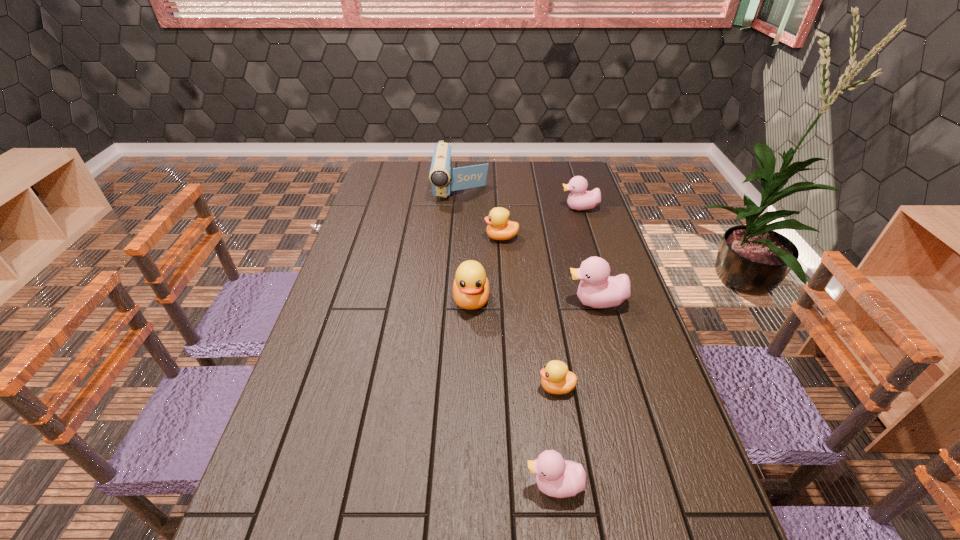
Image resolution: width=960 pixels, height=540 pixels. I want to click on the smallest yellow duckling, so click(556, 379).

Where is `free space located 0.190m on the side of the camcorder with the flip-out screen`? free space located 0.190m on the side of the camcorder with the flip-out screen is located at coordinates (458, 235).

Locate an element on the screen. vacant space located on the front-facing side of the biggest pink duckling is located at coordinates (450, 302).

Identify the location of blank area located on the front-facing side of the biggest pink duckling. Image resolution: width=960 pixels, height=540 pixels. (532, 302).

Find the location of a particular element. This screenshot has height=540, width=960. vacant area situated 0.120m on the front-facing side of the biggest pink duckling is located at coordinates (525, 302).

Image resolution: width=960 pixels, height=540 pixels. Find the location of `vacant position located 0.340m on the face of the biggest yellow duckling`. vacant position located 0.340m on the face of the biggest yellow duckling is located at coordinates (468, 428).

Find the location of a particular element. The height and width of the screenshot is (540, 960). vacant space located on the front-facing side of the farthest duckling is located at coordinates (458, 208).

What are the coordinates of `vacant region located 0.360m on the front-facing side of the farthest duckling` in the screenshot? It's located at (467, 208).

Find the location of a particular element. free space located on the front-facing side of the farthest duckling is located at coordinates (497, 208).

At what (x,y) coordinates should I click in order to perform the action: click on vacant space located 0.170m on the face of the second smallest yellow duckling. Please return your answer as a coordinate pair (x, y). Looking at the image, I should click on (436, 238).